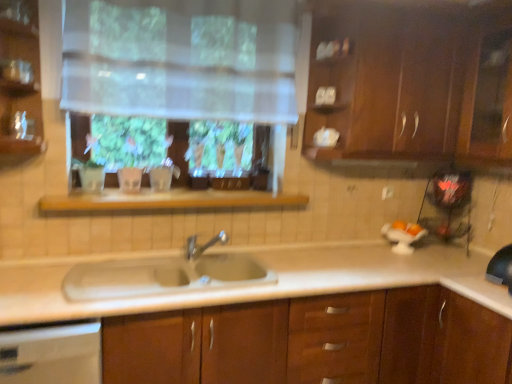
Question: Can you confirm if wooden shelf at center is positioned to the left of silver metallic faucet at center?

Choices:
 (A) yes
 (B) no

Answer: (A)

Question: Are wooden shelf at center and silver metallic faucet at center located far from each other?

Choices:
 (A) yes
 (B) no

Answer: (B)

Question: Is wooden shelf at center wider than silver metallic faucet at center?

Choices:
 (A) yes
 (B) no

Answer: (A)

Question: Is wooden shelf at center positioned with its back to silver metallic faucet at center?

Choices:
 (A) yes
 (B) no

Answer: (B)

Question: Does wooden shelf at center come in front of silver metallic faucet at center?

Choices:
 (A) no
 (B) yes

Answer: (B)

Question: Is wooden shelf at center shorter than silver metallic faucet at center?

Choices:
 (A) no
 (B) yes

Answer: (B)

Question: Can you confirm if brown wood cabinet at center, which ranks as the second cabinetry in top-to-bottom order, is wider than wooden shelf at center?

Choices:
 (A) yes
 (B) no

Answer: (A)

Question: From a real-world perspective, does brown wood cabinet at center, acting as the 1th cabinetry starting from the bottom, sit lower than wooden shelf at center?

Choices:
 (A) no
 (B) yes

Answer: (B)

Question: Is brown wood cabinet at center, which ranks as the second cabinetry in top-to-bottom order, closer to camera compared to wooden shelf at center?

Choices:
 (A) no
 (B) yes

Answer: (B)

Question: From the image's perspective, is brown wood cabinet at center, which ranks as the second cabinetry in top-to-bottom order, on wooden shelf at center?

Choices:
 (A) yes
 (B) no

Answer: (B)

Question: From the image's perspective, is brown wood cabinet at center, which ranks as the second cabinetry in top-to-bottom order, under wooden shelf at center?

Choices:
 (A) no
 (B) yes

Answer: (B)

Question: Is brown wood cabinet at center, which ranks as the second cabinetry in top-to-bottom order, to the left of wooden shelf at center from the viewer's perspective?

Choices:
 (A) yes
 (B) no

Answer: (B)

Question: Is white porcelain sink at center not within white glossy dishwasher at lower left?

Choices:
 (A) yes
 (B) no

Answer: (A)